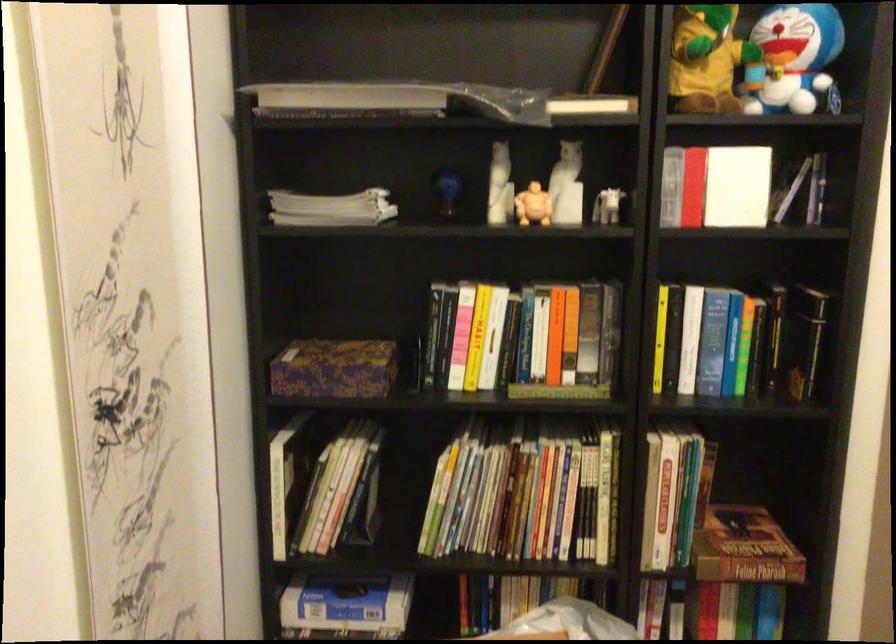
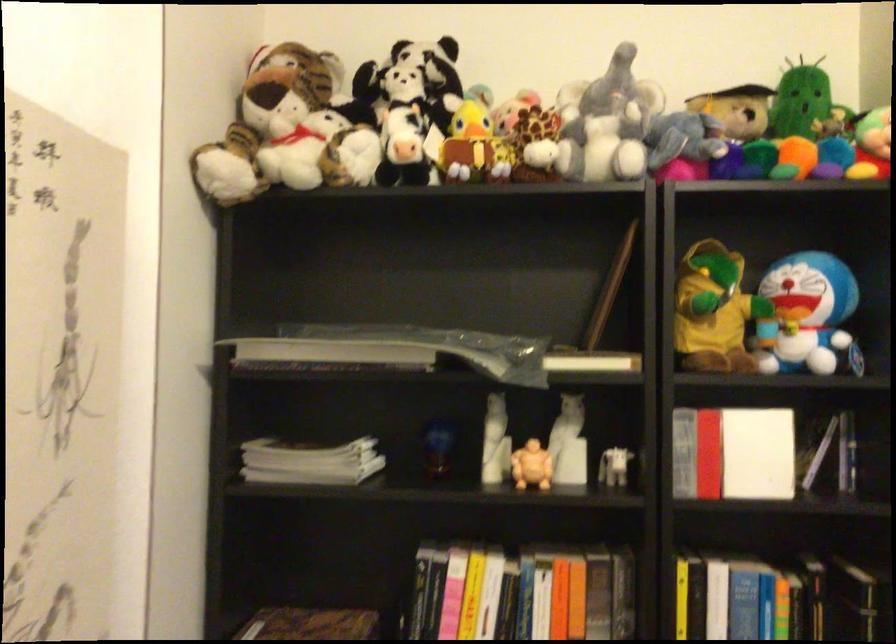
Locate, in the second image, the point that corresponds to point 738,184 in the first image.

(757, 453)